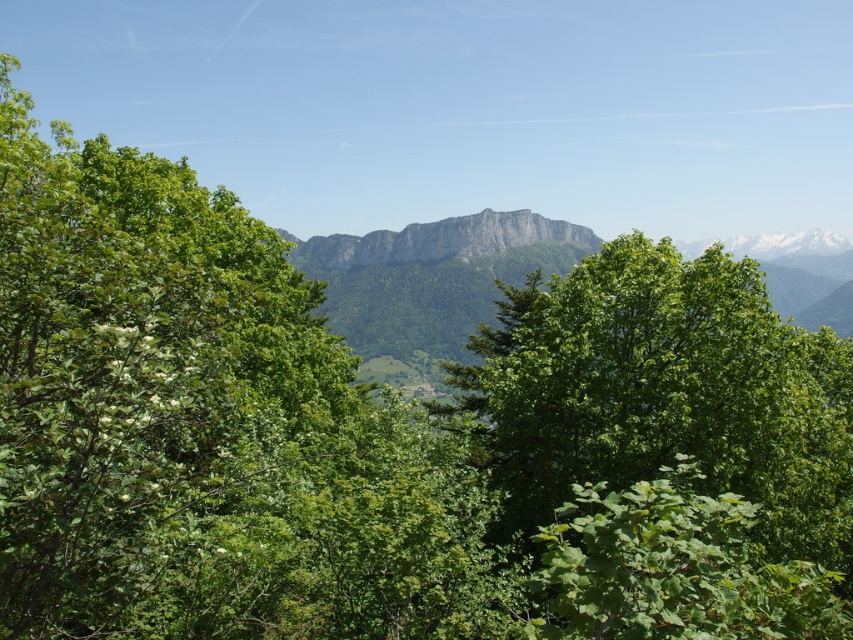
Between green leafy tree at center and gray rocky mountain range at center, which one has more height?

Standing taller between the two is gray rocky mountain range at center.

Based on the photo, is green leafy tree at center further to the viewer compared to gray rocky mountain range at center?

That is False.

Where is `green leafy tree at center`? green leafy tree at center is located at coordinates (664, 394).